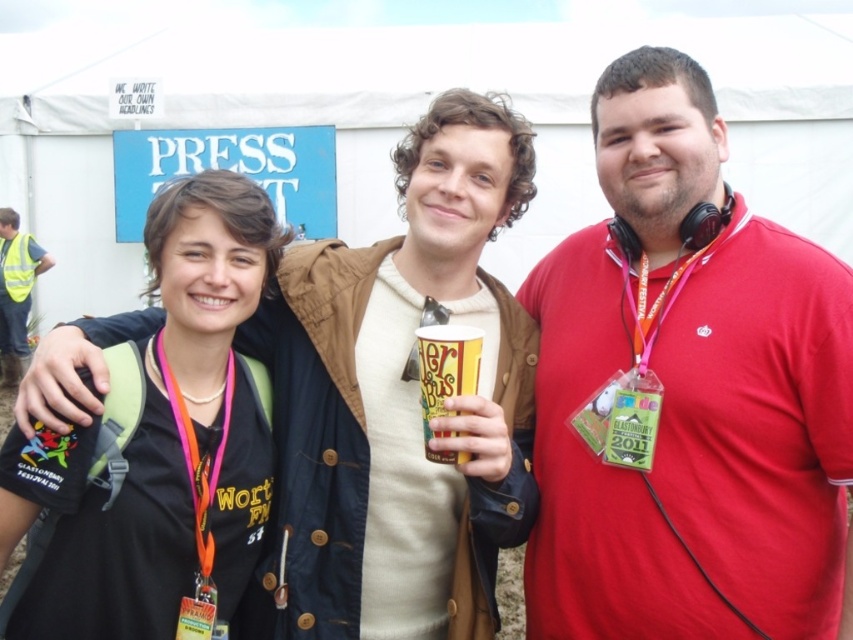
Question: Does yellow paper cup at center appear on the left side of high visibility vest at left?

Choices:
 (A) no
 (B) yes

Answer: (A)

Question: Which of the following is the closest to the observer?

Choices:
 (A) red cotton shirt at center
 (B) yellow paper cup at center

Answer: (B)

Question: Which point is closer to the camera taking this photo?

Choices:
 (A) (479, 368)
 (B) (465, 564)

Answer: (A)

Question: Can you confirm if red cotton shirt at center is wider than high visibility vest at left?

Choices:
 (A) no
 (B) yes

Answer: (B)

Question: Is matte brown jacket at center positioned in front of black fabric backpack at left?

Choices:
 (A) no
 (B) yes

Answer: (B)

Question: Which point appears closest to the camera in this image?

Choices:
 (A) (16, 264)
 (B) (460, 356)

Answer: (B)